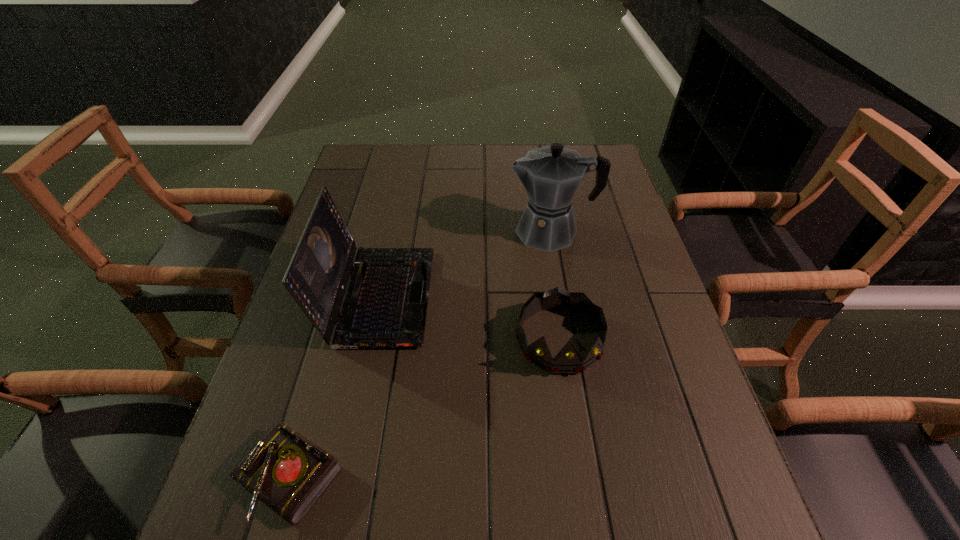
Locate an element on the screen. The height and width of the screenshot is (540, 960). coffeepot is located at coordinates (551, 175).

This screenshot has width=960, height=540. In order to click on the farthest object in this screenshot , I will do `click(551, 175)`.

Where is `laptop computer`? laptop computer is located at coordinates (385, 306).

This screenshot has height=540, width=960. Find the location of `tiara`. tiara is located at coordinates (569, 359).

Where is `diary`? The image size is (960, 540). diary is located at coordinates (289, 473).

What are the coordinates of `the nearest object` in the screenshot? It's located at (289, 473).

The image size is (960, 540). In order to click on vacant space located 0.120m at the spout of the coffeepot in this screenshot , I will do `click(466, 231)`.

You are a GUI agent. You are given a task and a screenshot of the screen. Output one action in this format:
    pyautogui.click(x=<x>, y=<y>)
    Task: Click on the blank space located 0.080m at the spout of the coffeepot
    The height and width of the screenshot is (540, 960).
    Given the screenshot: What is the action you would take?
    pyautogui.click(x=480, y=231)

Where is `vacant region located at the spout of the coffeepot`? The image size is (960, 540). vacant region located at the spout of the coffeepot is located at coordinates (417, 231).

Where is `vacant region located 0.320m on the screen of the laptop computer`? This screenshot has height=540, width=960. vacant region located 0.320m on the screen of the laptop computer is located at coordinates (559, 296).